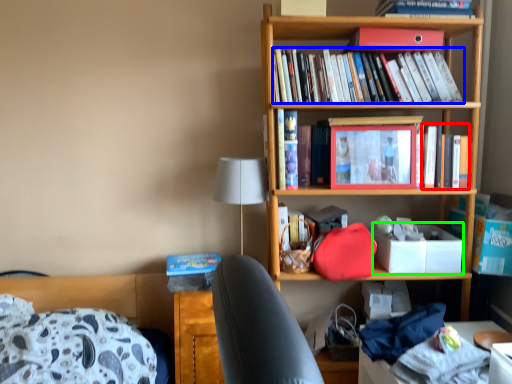
Question: Which is farther away from book (highlighted by a red box)? book (highlighted by a blue box) or box (highlighted by a green box)?

Choices:
 (A) book
 (B) box

Answer: (A)